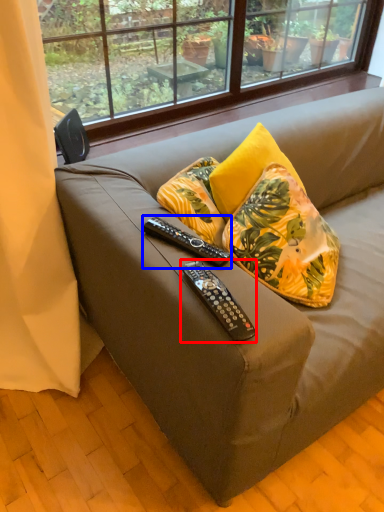
Question: Which object is closer to the camera taking this photo, remote control (highlighted by a red box) or remote control (highlighted by a blue box)?

Choices:
 (A) remote control
 (B) remote control

Answer: (A)